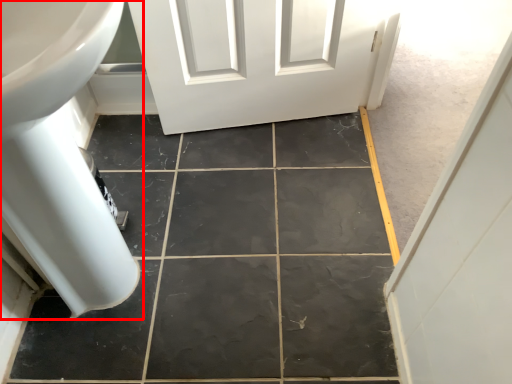
Question: In this image, where is bath (annotated by the red box) located relative to ceramic tile?

Choices:
 (A) left
 (B) right

Answer: (A)